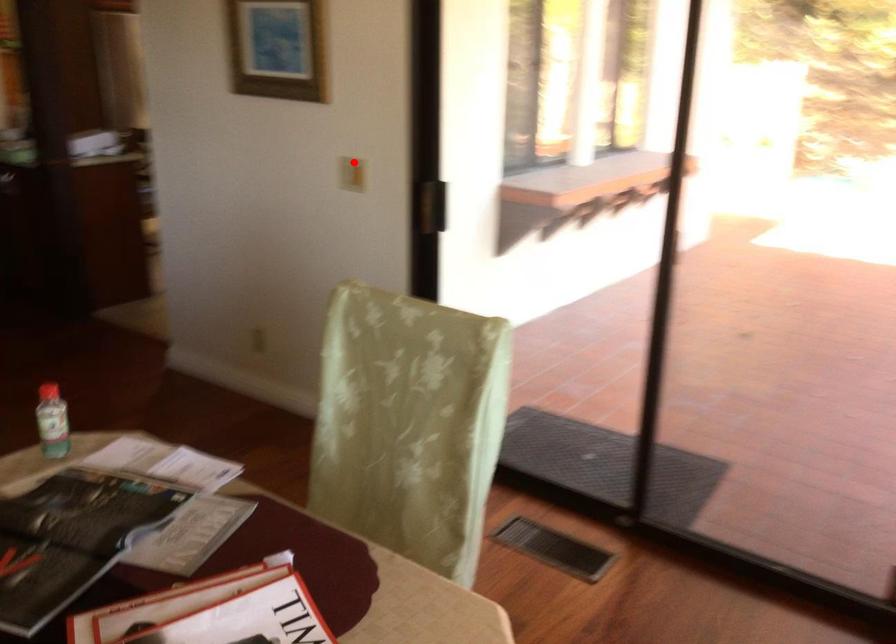
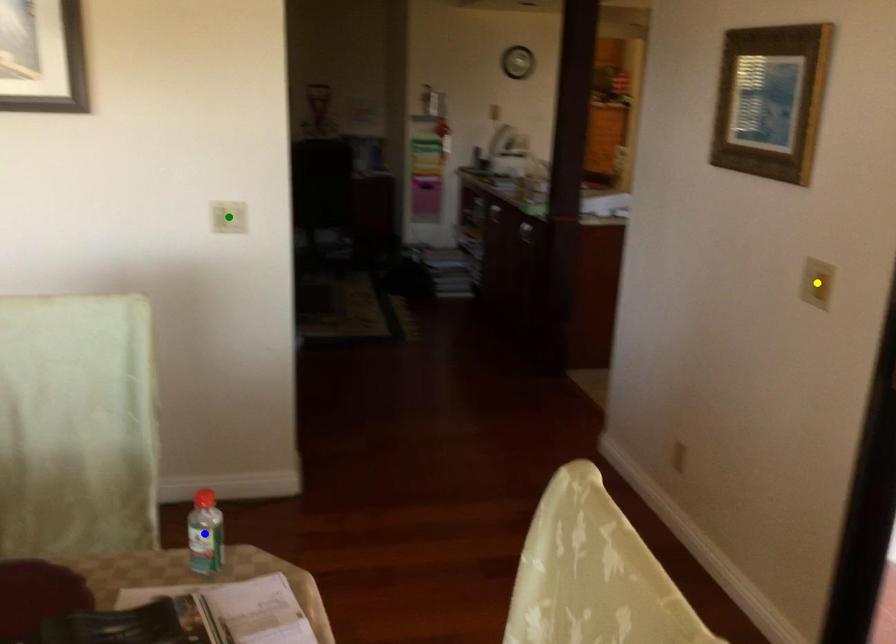
Question: I am providing you with two images of the same scene from different viewpoints. A red point is marked on the first image. You are given multiple points on the second image. In image 2, which mark is for the same physical point as the one in image 1?

Choices:
 (A) blue point
 (B) green point
 (C) yellow point

Answer: (C)